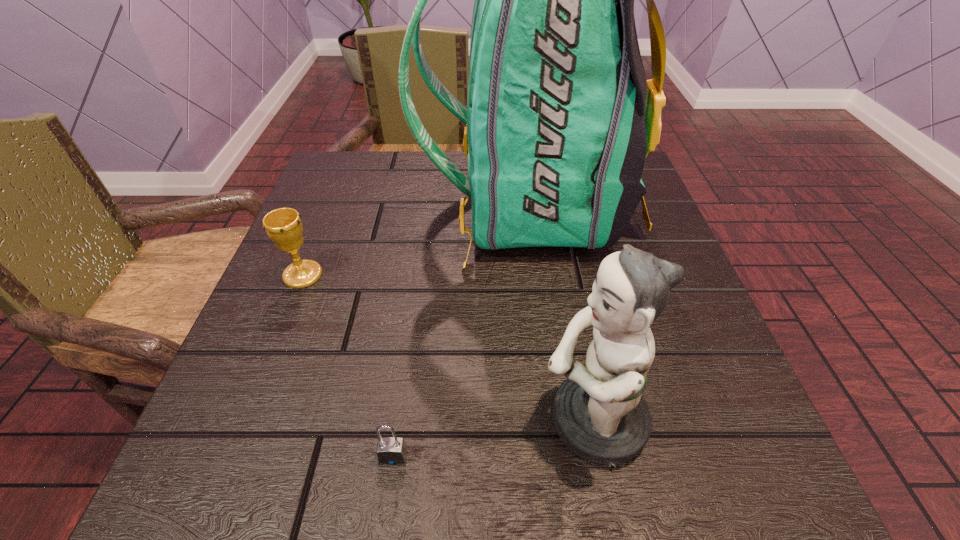
Find the location of a particular element. blank area located 0.270m on the front-facing side of the figurine is located at coordinates (339, 421).

This screenshot has width=960, height=540. In order to click on vacant point located 0.240m on the right of the third tallest object in this screenshot , I will do `click(455, 275)`.

The width and height of the screenshot is (960, 540). I want to click on object positioned at the far edge, so click(560, 117).

Locate an element on the screen. The width and height of the screenshot is (960, 540). figurine that is positioned at the near edge is located at coordinates (599, 412).

Find the location of a particular element. This screenshot has height=540, width=960. padlock at the near edge is located at coordinates (391, 450).

Identify the location of object present at the left edge. The width and height of the screenshot is (960, 540). (284, 226).

You are a GUI agent. You are given a task and a screenshot of the screen. Output one action in this format:
    pyautogui.click(x=<x>, y=<y>)
    Task: Click on the backpack located in the right edge section of the desktop
    The width and height of the screenshot is (960, 540).
    Given the screenshot: What is the action you would take?
    pyautogui.click(x=560, y=117)

Locate an element on the screen. figurine that is positioned at the right edge is located at coordinates (599, 412).

At what (x,y) coordinates should I click in order to perform the action: click on object that is at the far right corner. Please return your answer as a coordinate pair (x, y). Looking at the image, I should click on (560, 117).

The height and width of the screenshot is (540, 960). In order to click on object that is at the near right corner in this screenshot , I will do `click(599, 412)`.